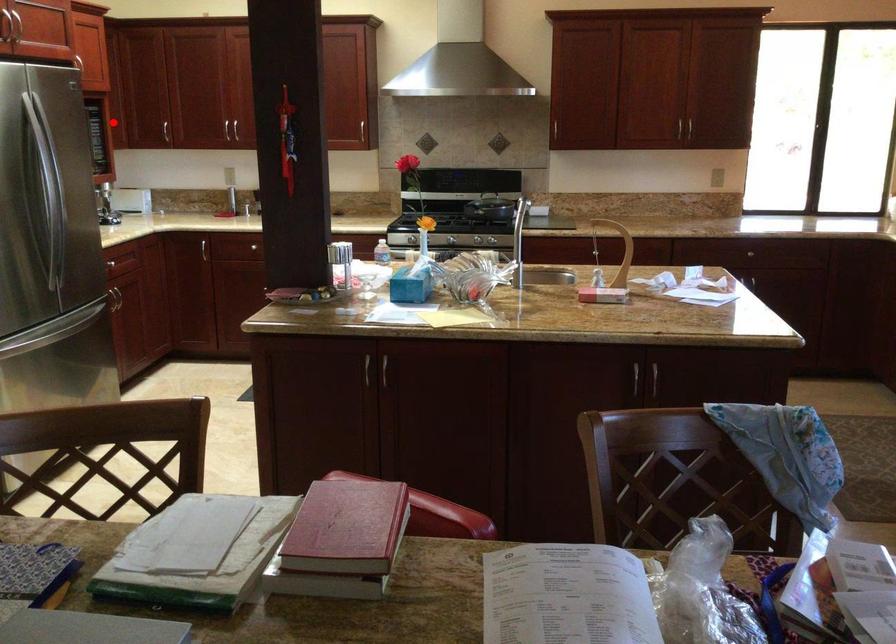
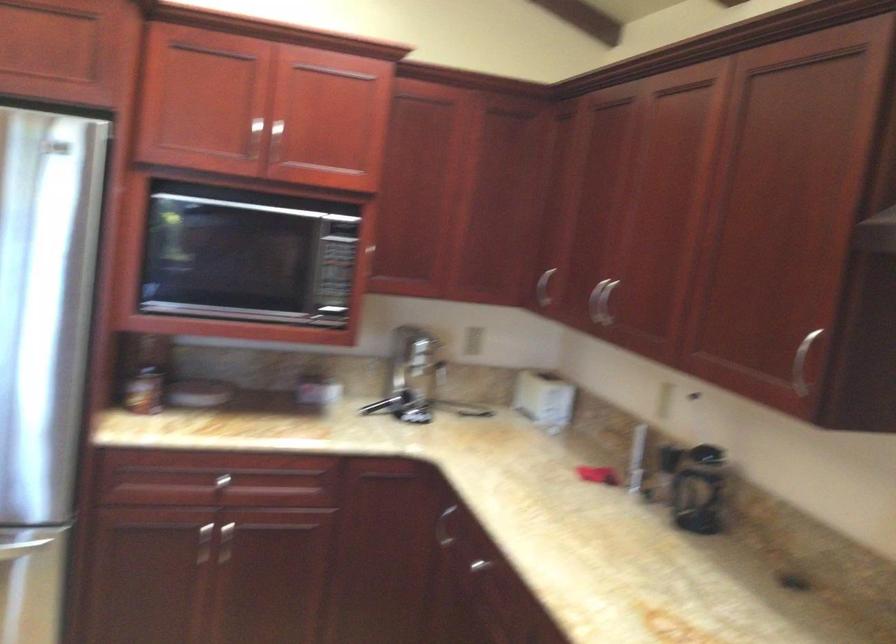
Question: I am providing you with two images of the same scene from different viewpoints. A red point is shown in image1. For the corresponding object point in image2, is it positioned nearer or farther from the camera?

Choices:
 (A) Nearer
 (B) Farther

Answer: (A)